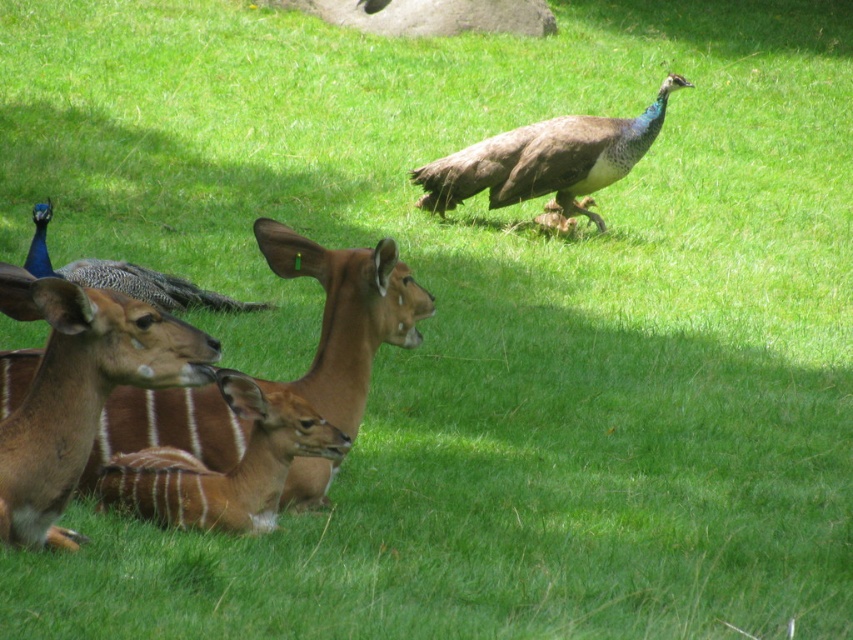
Does brown velvet antelope at left appear on the left side of blue glossy peacock at left?

In fact, brown velvet antelope at left is to the right of blue glossy peacock at left.

What are the coordinates of `brown velvet antelope at left` in the screenshot? It's located at (347, 314).

Image resolution: width=853 pixels, height=640 pixels. What do you see at coordinates (347, 314) in the screenshot?
I see `brown velvet antelope at left` at bounding box center [347, 314].

Locate an element on the screen. brown velvet antelope at left is located at coordinates (347, 314).

Who is taller, brown velvet deer at left or brown velvet deer at lower left?

brown velvet deer at left is taller.

Which is behind, point (143, 353) or point (173, 456)?

Point (173, 456)

The height and width of the screenshot is (640, 853). In order to click on brown velvet deer at left in this screenshot , I will do pyautogui.click(x=79, y=390).

Measure the distance between brown velvet antelope at left and camera.

They are 4.60 meters apart.

Is point (245, 428) behind point (56, 369)?

Yes, it is.

Identify the location of brown velvet antelope at left. The image size is (853, 640). (347, 314).